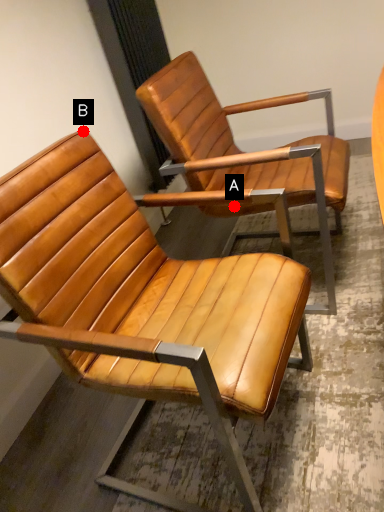
Question: Two points are circled on the image, labeled by A and B beside each circle. Which point is closer to the camera?

Choices:
 (A) A is closer
 (B) B is closer

Answer: (A)